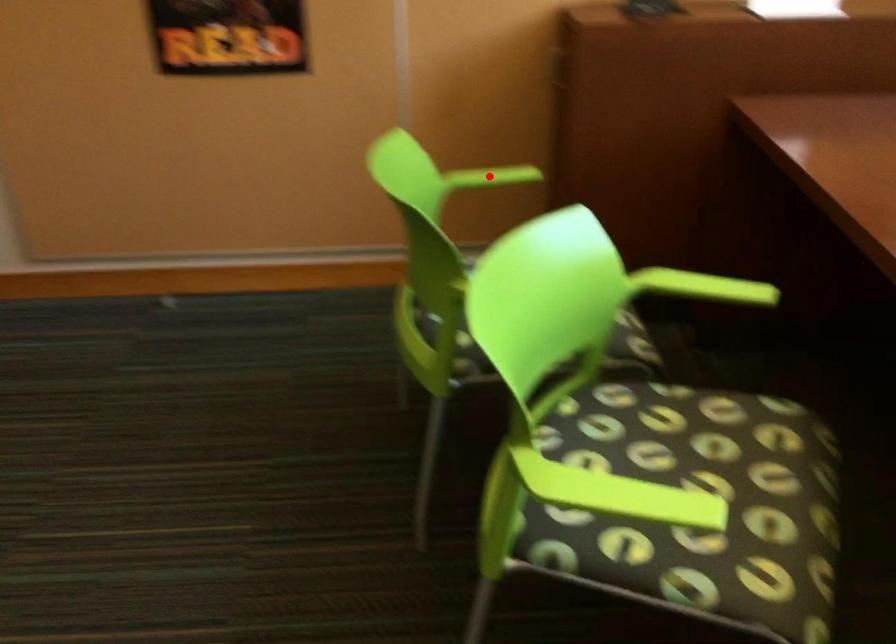
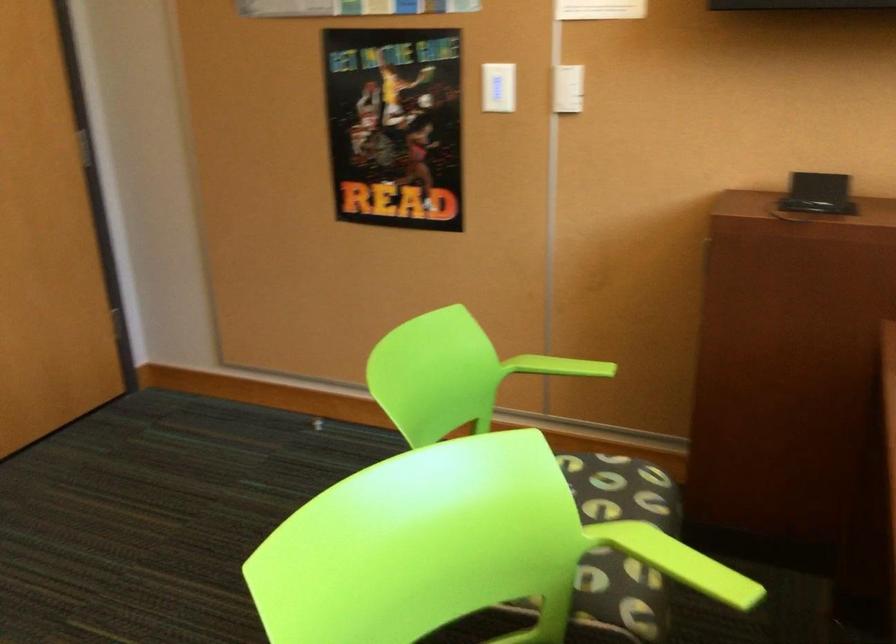
Find the pixel in the second image that matches the highlighted location in the first image.

(558, 366)